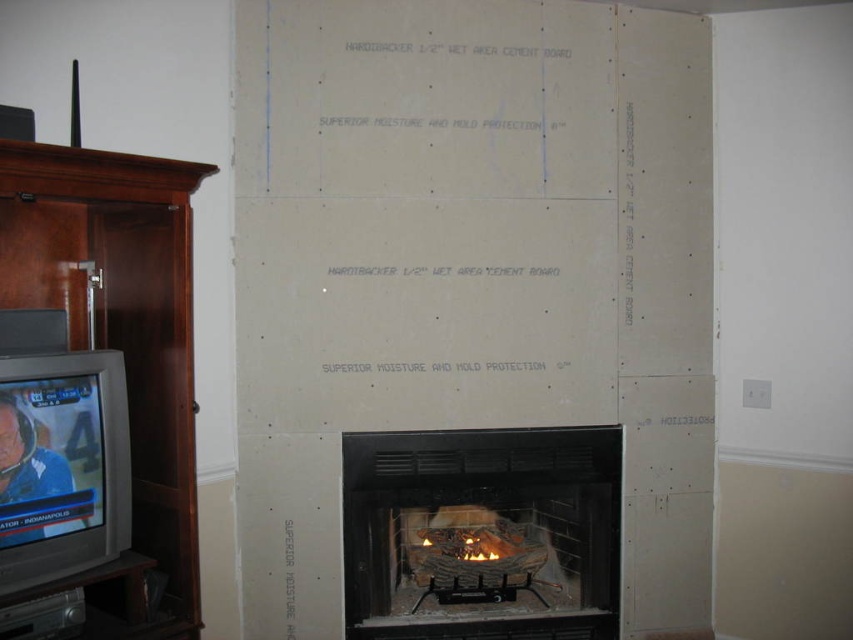
Question: Among these objects, which one is nearest to the camera?

Choices:
 (A) matte gray television at left
 (B) dark wood entertainment center at left

Answer: (B)

Question: Among these objects, which one is nearest to the camera?

Choices:
 (A) matte black fireplace at center
 (B) dark wood entertainment center at left

Answer: (B)

Question: Can you confirm if dark wood entertainment center at left is wider than matte gray television at left?

Choices:
 (A) no
 (B) yes

Answer: (B)

Question: Does matte black fireplace at center lie behind matte gray television at left?

Choices:
 (A) yes
 (B) no

Answer: (A)

Question: Which point appears farthest from the camera in this image?

Choices:
 (A) (51, 387)
 (B) (354, 547)

Answer: (B)

Question: Does matte black fireplace at center appear on the left side of matte gray television at left?

Choices:
 (A) no
 (B) yes

Answer: (A)